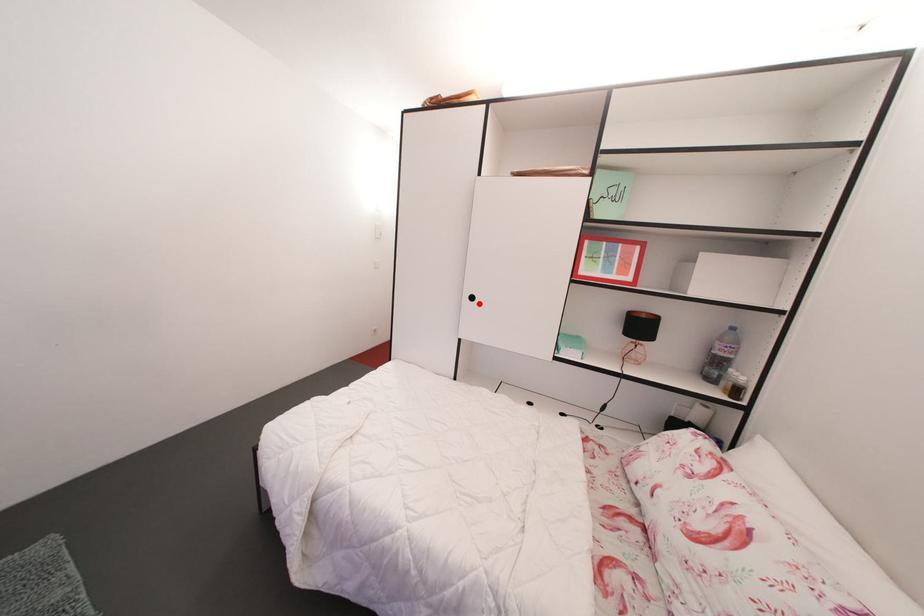
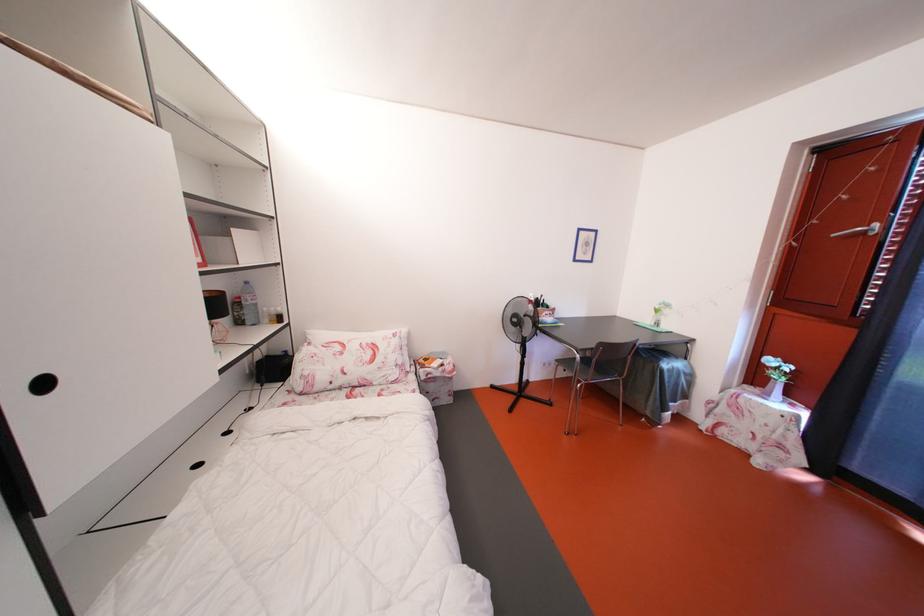
The point at the highlighted location is marked in the first image. Where is the corresponding point in the second image?

(52, 390)